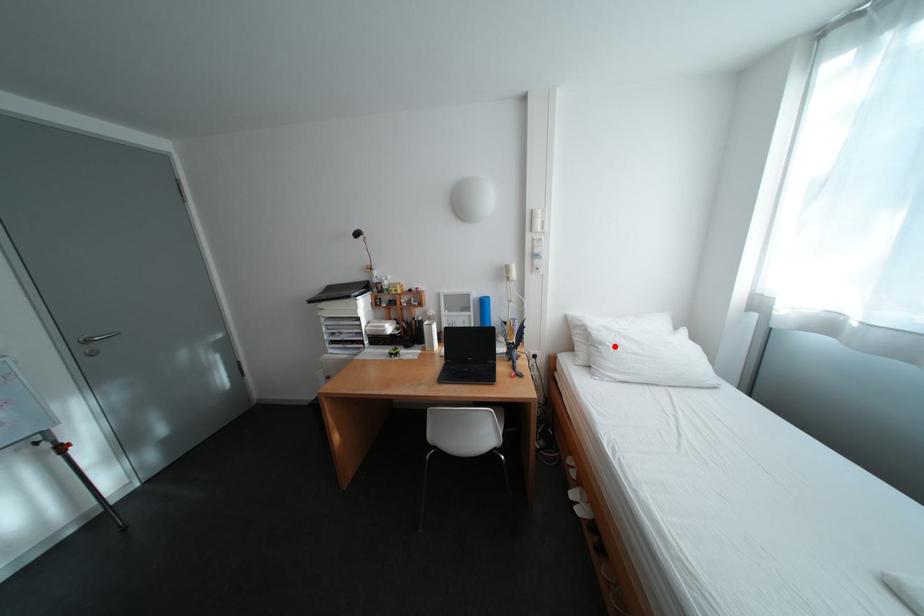
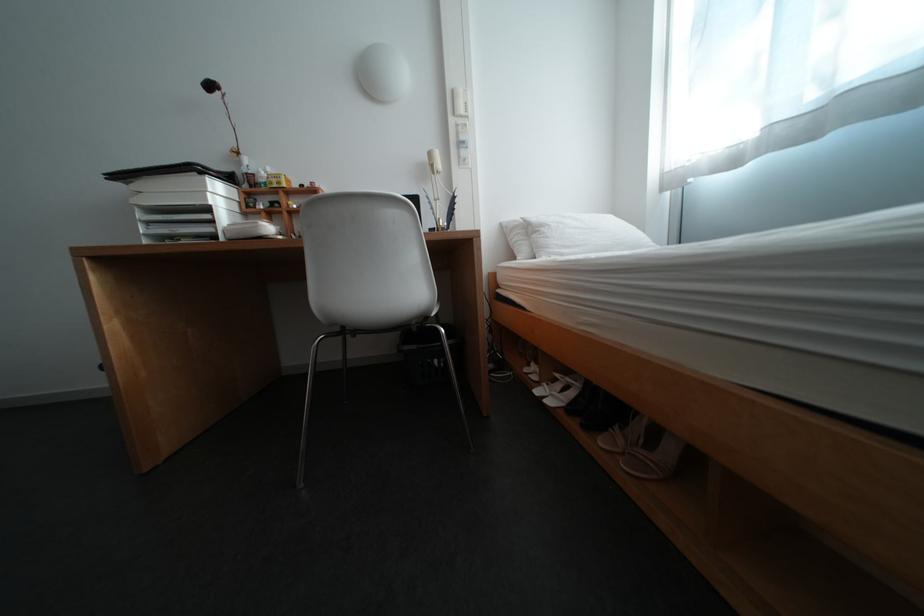
Question: I am providing you with two images of the same scene from different viewpoints. Given a red point in image1, look at the same physical point in image2. Is it:

Choices:
 (A) Closer to the viewpoint
 (B) Farther from the viewpoint

Answer: (A)